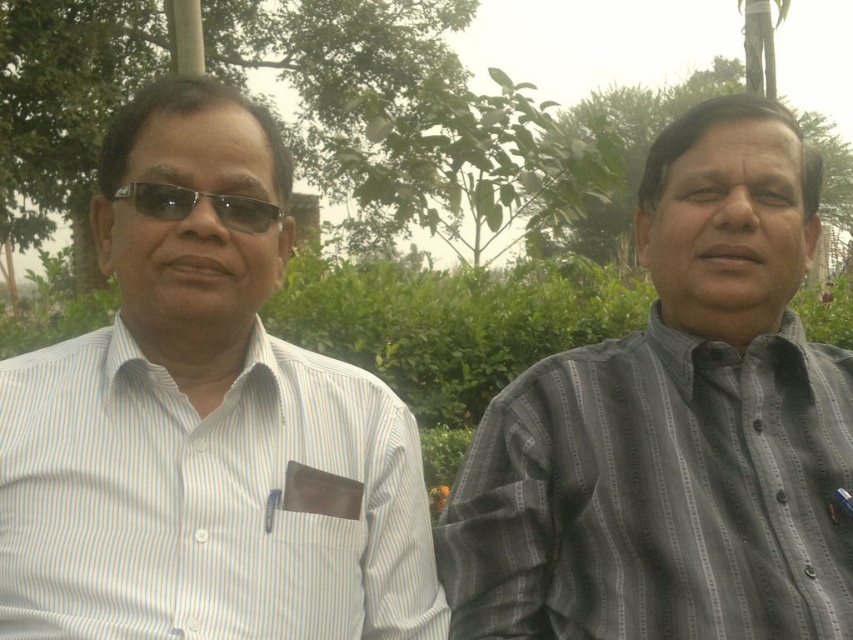
Is gray striped shirt at right above black plastic glasses at left?

No.

Which of these two, gray striped shirt at right or black plastic glasses at left, stands shorter?

Standing shorter between the two is black plastic glasses at left.

Measure the distance between point (x=573, y=584) and camera.

They are 1.40 meters apart.

In order to click on gray striped shirt at right in this screenshot , I will do `click(675, 428)`.

Which is behind, point (248, 552) or point (148, 188)?

Point (148, 188)

Can you confirm if white striped shirt at left is positioned to the right of black plastic glasses at left?

Correct, you'll find white striped shirt at left to the right of black plastic glasses at left.

Which is behind, point (384, 476) or point (166, 200)?

Point (384, 476)

Locate an element on the screen. This screenshot has width=853, height=640. white striped shirt at left is located at coordinates 209,500.

Consider the image. Between gray striped shirt at right and white striped shirt at left, which one has more height?

Standing taller between the two is gray striped shirt at right.

Between point (827, 364) and point (80, 442), which one is positioned in front?

Positioned in front is point (80, 442).

This screenshot has height=640, width=853. I want to click on gray striped shirt at right, so click(675, 428).